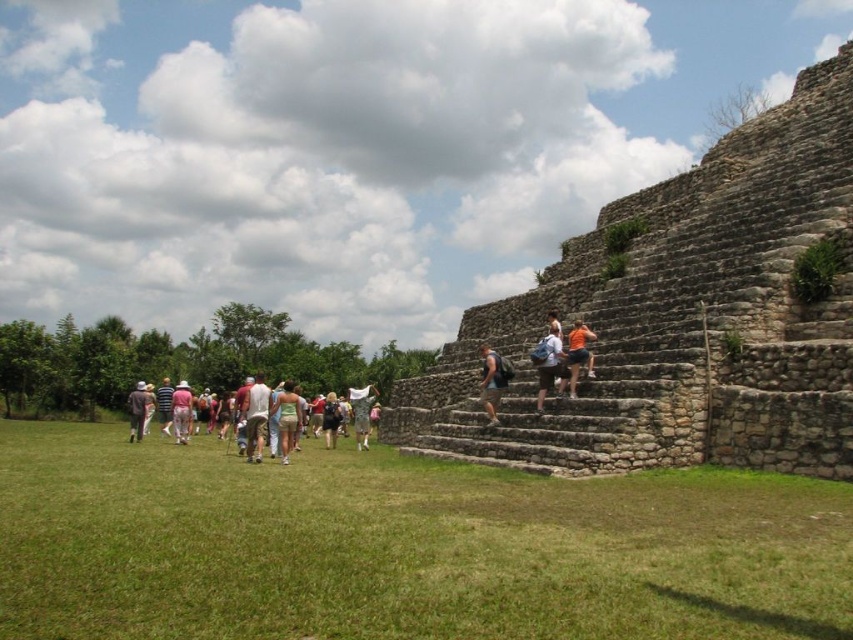
Does matte brown backpack at center have a lesser width compared to pink cotton pants at center?

Yes, matte brown backpack at center is thinner than pink cotton pants at center.

Is point (498, 397) closer to camera compared to point (177, 410)?

Yes.

The image size is (853, 640). I want to click on matte brown backpack at center, so click(x=491, y=381).

This screenshot has width=853, height=640. What are the coordinates of `matte brown backpack at center` in the screenshot? It's located at (491, 381).

Can you confirm if rustic stone stairs at center is wider than white cotton shirt at center?

Correct, the width of rustic stone stairs at center exceeds that of white cotton shirt at center.

Is point (462, 433) positioned in front of point (541, 362)?

No, it is behind (541, 362).

What do you see at coordinates (682, 320) in the screenshot?
I see `rustic stone stairs at center` at bounding box center [682, 320].

Where is `rustic stone stairs at center`? This screenshot has width=853, height=640. rustic stone stairs at center is located at coordinates (682, 320).

Does white cotton shirt at center appear on the right side of orange cotton shirt at center?

No, white cotton shirt at center is not to the right of orange cotton shirt at center.

Between point (560, 346) and point (572, 372), which one is positioned in front?

Point (572, 372)

Does point (560, 358) come closer to viewer compared to point (583, 362)?

No, (560, 358) is further to viewer.

Find the location of a particular element. white cotton shirt at center is located at coordinates (549, 364).